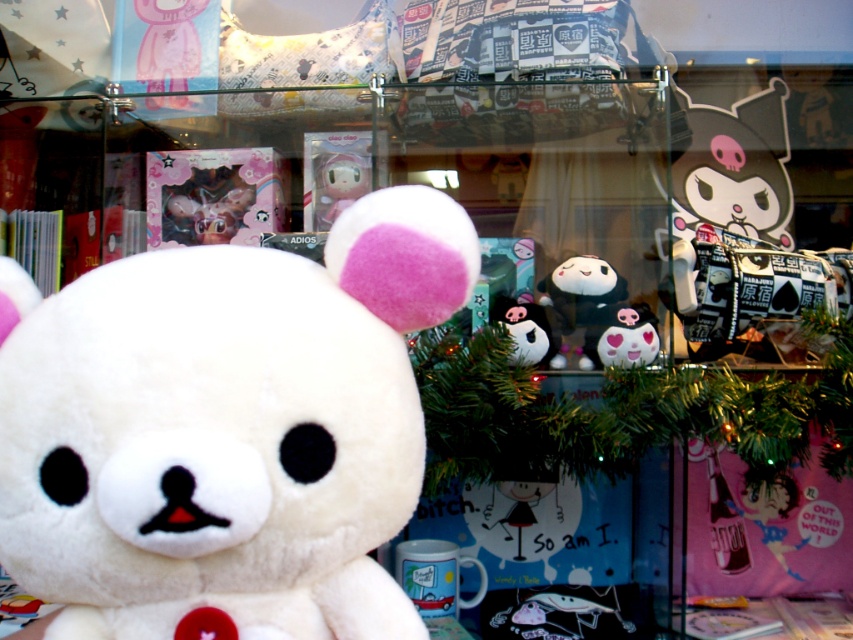
Is black plush toy at center positioned at the back of white plush toy at center?

No, it is not.

Who is more distant from viewer, (518, 314) or (622, 328)?

Positioned behind is point (518, 314).

Identify the location of black plush toy at center. The image size is (853, 640). (524, 330).

Is matte pink plush bear at upper left bigger than white plush toy at center?

Yes.

This screenshot has height=640, width=853. Describe the element at coordinates (167, 42) in the screenshot. I see `matte pink plush bear at upper left` at that location.

You are a GUI agent. You are given a task and a screenshot of the screen. Output one action in this format:
    pyautogui.click(x=<x>, y=<y>)
    Task: Click on the matte pink plush bear at upper left
    The height and width of the screenshot is (640, 853).
    Given the screenshot: What is the action you would take?
    pyautogui.click(x=167, y=42)

In the scene shown: Is white plush bear at center below black plush toy at center?

Indeed, white plush bear at center is positioned under black plush toy at center.

Which is in front, point (204, 524) or point (509, 324)?

Point (204, 524) is in front.

In order to click on white plush bear at center in this screenshot , I will do `click(228, 429)`.